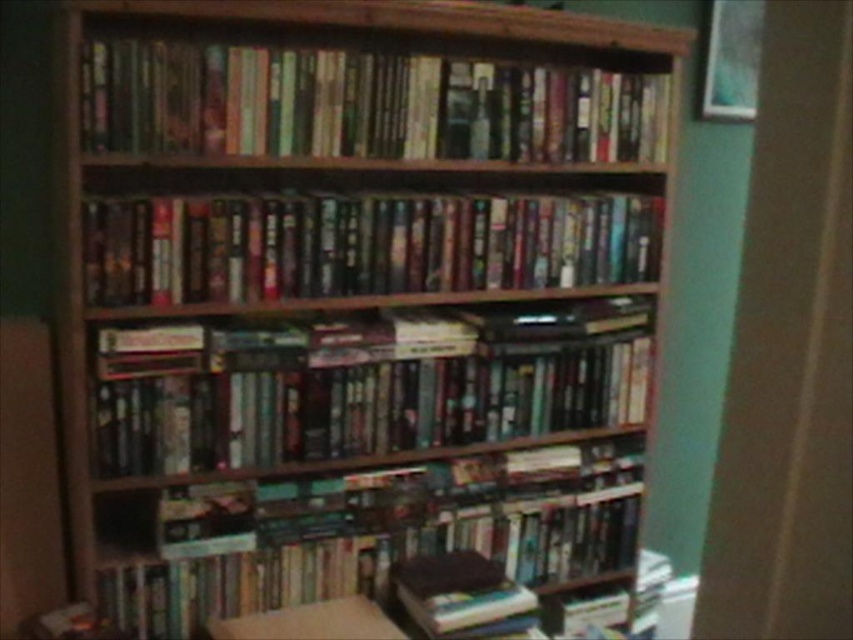
Who is more forward, (589,403) or (97,220)?

Point (97,220) is in front.

Can you confirm if hardcover books at center is wider than shiny plastic books at center?

No.

Is point (567, 348) farther from viewer compared to point (114, 209)?

Yes, point (567, 348) is farther from viewer.

Locate an element on the screen. The image size is (853, 640). hardcover books at center is located at coordinates tap(378, 397).

Image resolution: width=853 pixels, height=640 pixels. I want to click on hardcover books at upper center, so click(363, 104).

Locate an element on the screen. Image resolution: width=853 pixels, height=640 pixels. hardcover books at upper center is located at coordinates (363, 104).

The width and height of the screenshot is (853, 640). I want to click on hardcover books at upper center, so click(363, 104).

Is point (347, 77) positioned behind point (155, 198)?

Yes, point (347, 77) is behind point (155, 198).

Does hardcover books at upper center lie behind shiny plastic books at center?

No.

Does point (396, 70) come behind point (590, 208)?

No, (396, 70) is closer to viewer.

Where is `hardcover books at upper center`? The height and width of the screenshot is (640, 853). hardcover books at upper center is located at coordinates (363, 104).